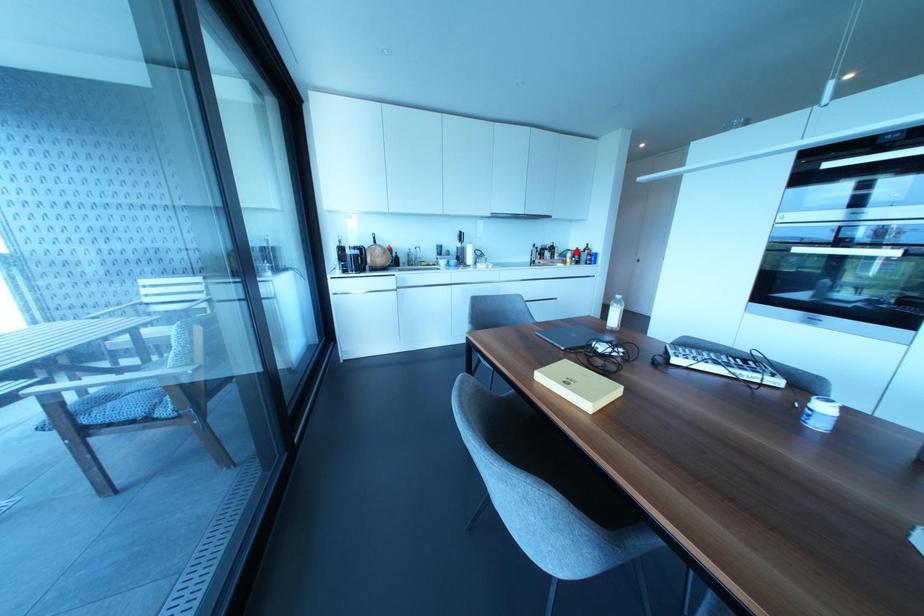
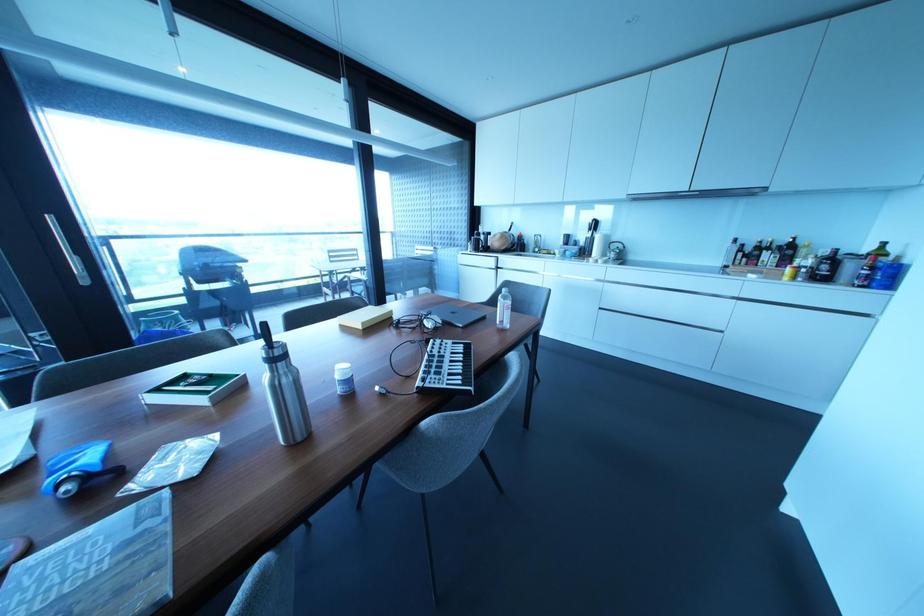
Locate, in the second image, the point that corresponds to the highlighted location in the first image.

(833, 257)